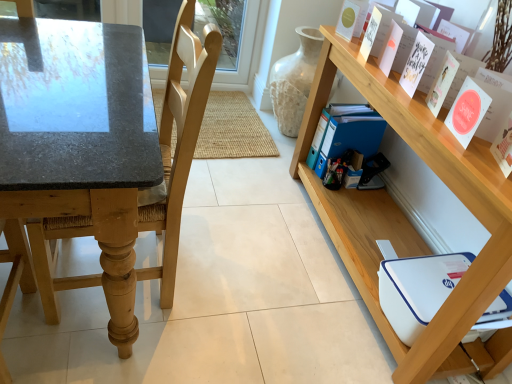
Image resolution: width=512 pixels, height=384 pixels. Identify the location of free space in front of translucent glass vase at upper right. (265, 153).